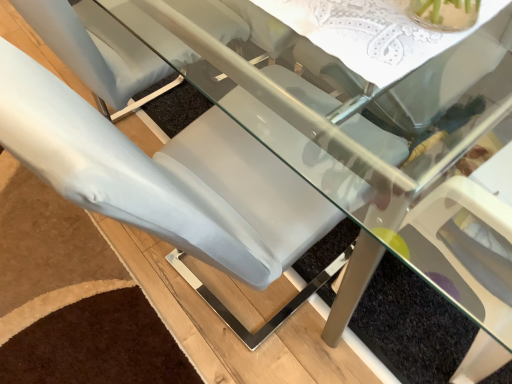
Identify the location of blank space situated above white matte chair at lower left (from a real-world perspective). click(x=89, y=281).